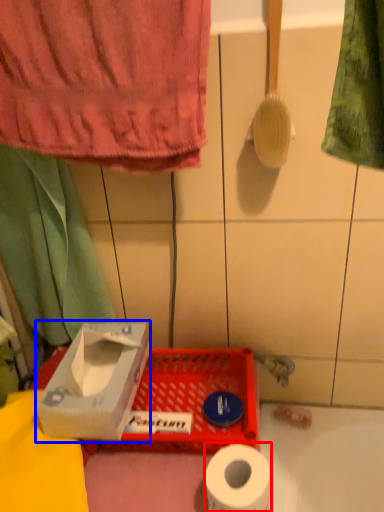
Question: Which object appears farthest to the camera in this image, toilet paper (highlighted by a red box) or cardboard box (highlighted by a blue box)?

Choices:
 (A) toilet paper
 (B) cardboard box

Answer: (B)